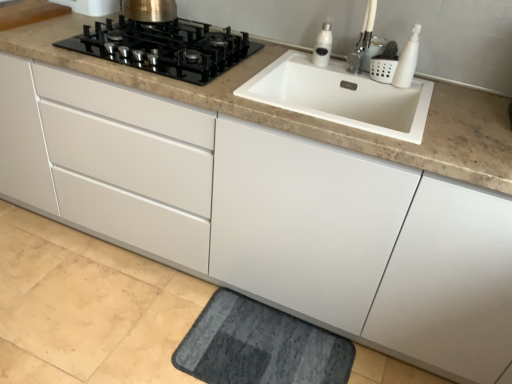
Where is `free region on the left part of white glossy soap dispenser at upper right, the second soap dispenser from the right`? This screenshot has width=512, height=384. free region on the left part of white glossy soap dispenser at upper right, the second soap dispenser from the right is located at coordinates (292, 60).